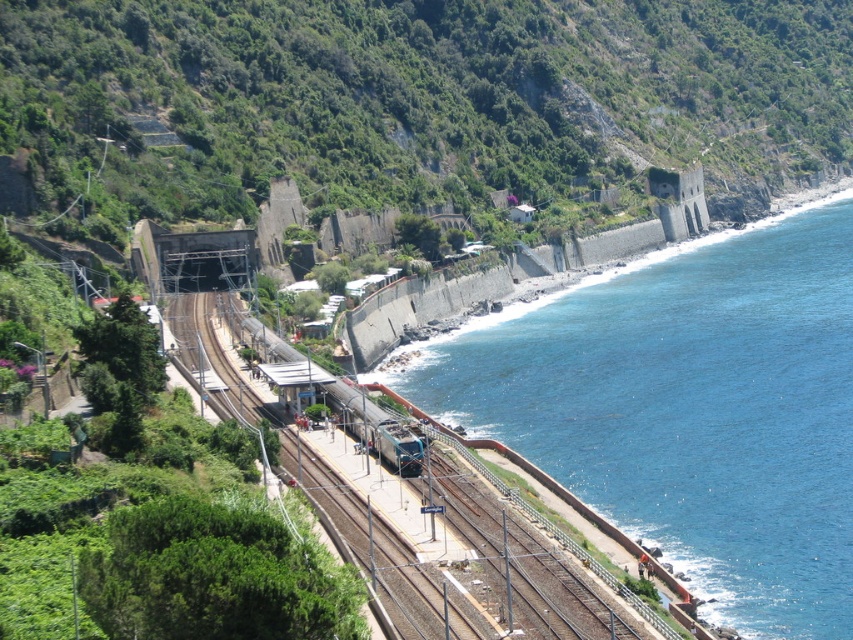
You are a photographer standing on the platform at the scenic railway station. You want to capture a photo of both the brown gravel track at center and the metallic blue train at center. Which object should you focus on first to ensure both are in sharp focus?

You should focus on the brown gravel track at center first because it is closer to the viewer than the metallic blue train at center. By focusing on the closer object, the train will still be in focus due to the depth of field, ensuring both are sharp.

You are a passenger on the metallic blue train at center and want to walk to the brown gravel track at center. Is the track above or below your current position?

The brown gravel track at center is located above the metallic blue train at center, so the track is above your current position.

You are a photographer planning to capture the railway station scene. You want to include both the blue water at lower right and the brown gravel track at center in your shot. Which object will occupy more space in the photo?

The blue water at lower right occupies more space in the photo because it is bigger than the brown gravel track at center according to the description.